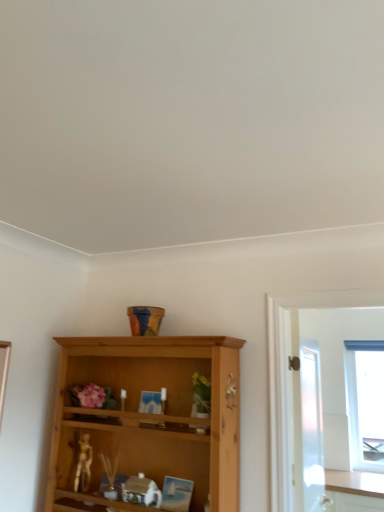
Question: Is metallic gold figurine at lower left placed right next to white frosted glass screen door at right?

Choices:
 (A) no
 (B) yes

Answer: (A)

Question: Considering the relative positions of metallic gold figurine at lower left and white frosted glass screen door at right in the image provided, is metallic gold figurine at lower left to the right of white frosted glass screen door at right from the viewer's perspective?

Choices:
 (A) yes
 (B) no

Answer: (B)

Question: Is white frosted glass screen door at right at the back of metallic gold figurine at lower left?

Choices:
 (A) no
 (B) yes

Answer: (A)

Question: Is metallic gold figurine at lower left not inside white frosted glass screen door at right?

Choices:
 (A) no
 (B) yes

Answer: (B)

Question: Is metallic gold figurine at lower left wider than white frosted glass screen door at right?

Choices:
 (A) yes
 (B) no

Answer: (A)

Question: Looking at the image, does metallic gold figurine at lower left seem bigger or smaller compared to transparent glass window at right?

Choices:
 (A) small
 (B) big

Answer: (A)

Question: Does point (82, 467) appear closer or farther from the camera than point (367, 404)?

Choices:
 (A) farther
 (B) closer

Answer: (B)

Question: In the image, is metallic gold figurine at lower left positioned in front of or behind transparent glass window at right?

Choices:
 (A) front
 (B) behind

Answer: (A)

Question: Considering the relative positions of metallic gold figurine at lower left and transparent glass window at right in the image provided, is metallic gold figurine at lower left to the left or to the right of transparent glass window at right?

Choices:
 (A) right
 (B) left

Answer: (B)

Question: Considering the positions of white frosted glass screen door at right and transparent glass window at right in the image, is white frosted glass screen door at right wider or thinner than transparent glass window at right?

Choices:
 (A) thin
 (B) wide

Answer: (A)

Question: From the image's perspective, relative to transparent glass window at right, is white frosted glass screen door at right above or below?

Choices:
 (A) above
 (B) below

Answer: (A)

Question: Is white frosted glass screen door at right inside or outside of transparent glass window at right?

Choices:
 (A) outside
 (B) inside

Answer: (A)

Question: From a real-world perspective, relative to transparent glass window at right, is white frosted glass screen door at right vertically above or below?

Choices:
 (A) above
 (B) below

Answer: (A)

Question: Is metallic gold figurine at lower left wider or thinner than white frosted glass screen door at right?

Choices:
 (A) thin
 (B) wide

Answer: (B)

Question: Is metallic gold figurine at lower left bigger or smaller than white frosted glass screen door at right?

Choices:
 (A) small
 (B) big

Answer: (A)